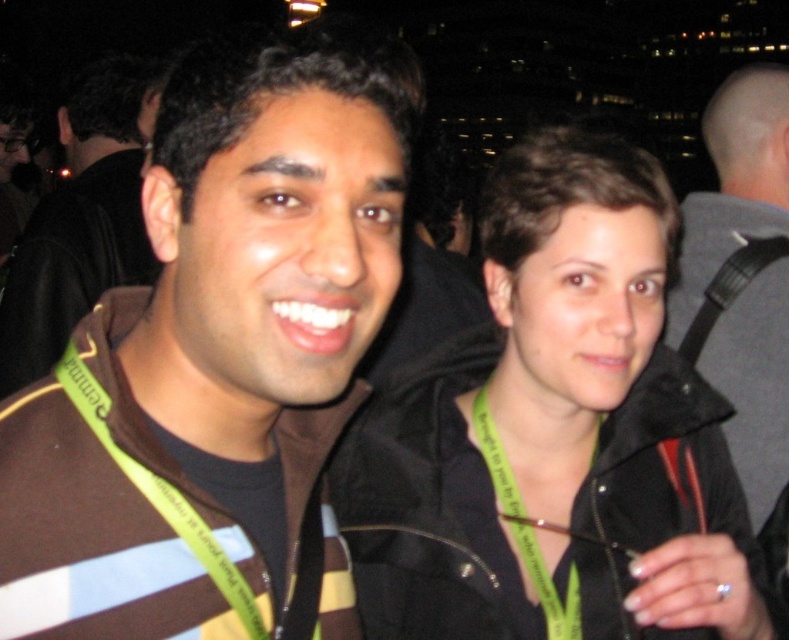
You are at a party and need to know which object is taller between the brown striped sweater at left and the green fabric lanyard at center. Can you tell me?

The brown striped sweater at left has a greater height compared to the green fabric lanyard at center, so the brown striped sweater at left is taller.